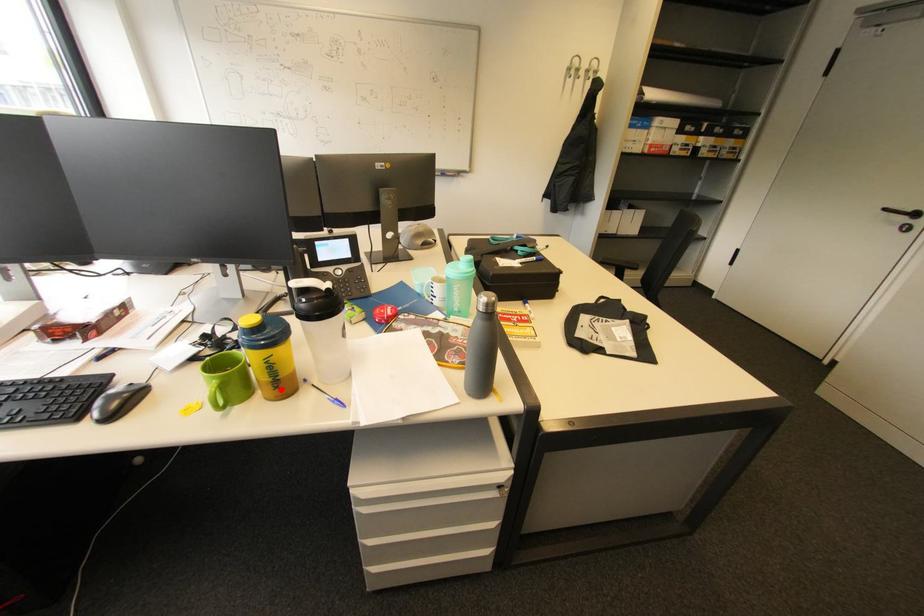
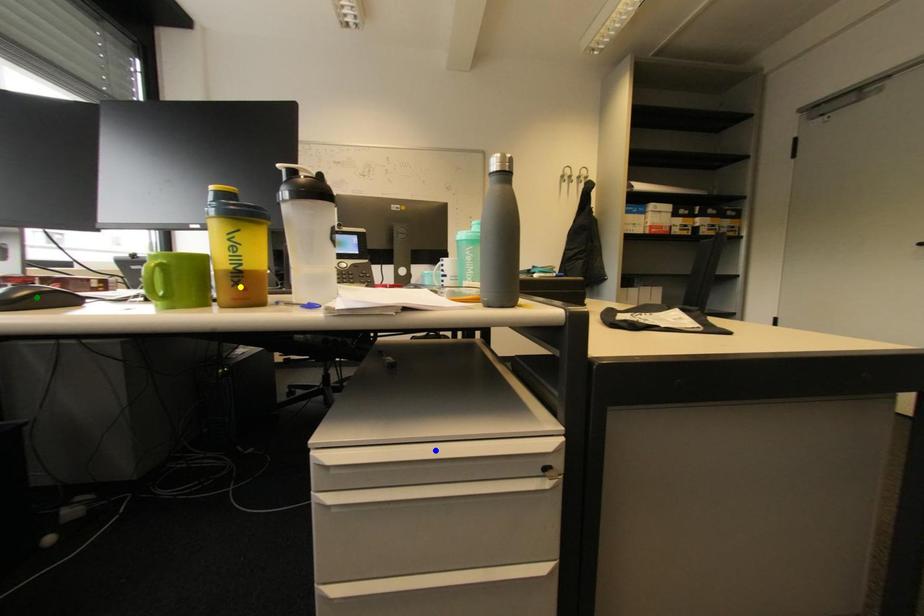
Question: I am providing you with two images of the same scene from different viewpoints. A red point is marked on the first image. You are given multiple points on the second image. Which spot in image 2 lines up with the point in image 1?

Choices:
 (A) blue point
 (B) yellow point
 (C) green point

Answer: (B)